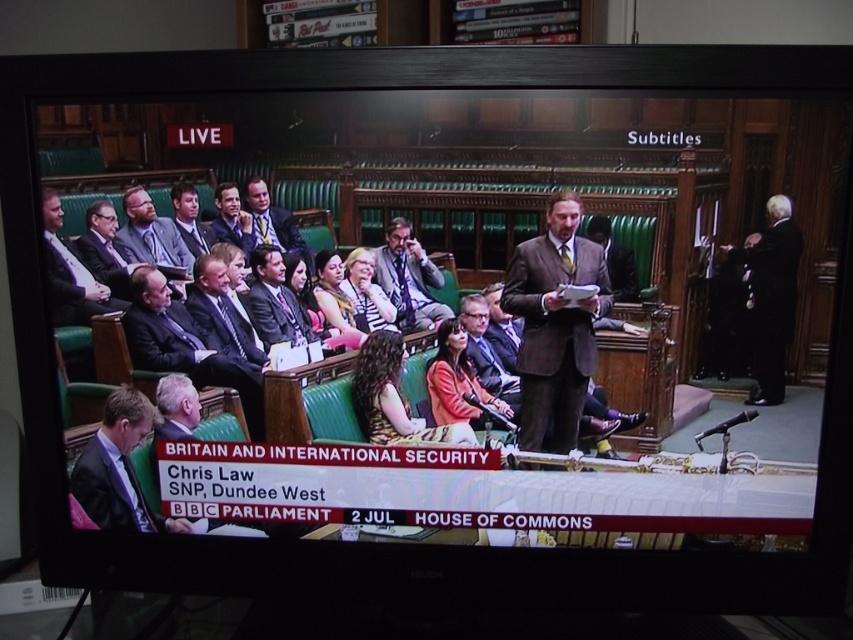
Question: Which of the following is the farthest from the observer?

Choices:
 (A) matte gray suit at left
 (B) matte gray suit at center

Answer: (A)

Question: Does matte black suit at left have a greater width compared to matte gray suit at center?

Choices:
 (A) yes
 (B) no

Answer: (A)

Question: Is dark brown suit at center wider than black suit at right?

Choices:
 (A) no
 (B) yes

Answer: (B)

Question: Based on their relative distances, which object is farther from the matte gray suit at center?

Choices:
 (A) black suit at right
 (B) light brown suit at center
 (C) matte black suit at left

Answer: (A)

Question: Is black suit at right wider than matte gray suit at left?

Choices:
 (A) yes
 (B) no

Answer: (A)

Question: Which of the following is the closest to the observer?

Choices:
 (A) (578, 374)
 (B) (160, 307)
 (C) (138, 250)
 (D) (413, 250)

Answer: (D)